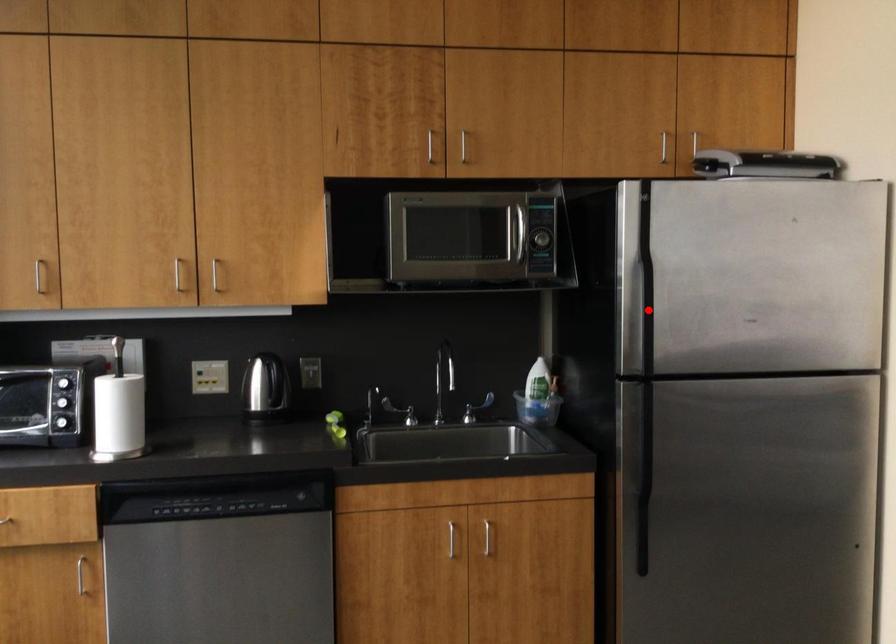
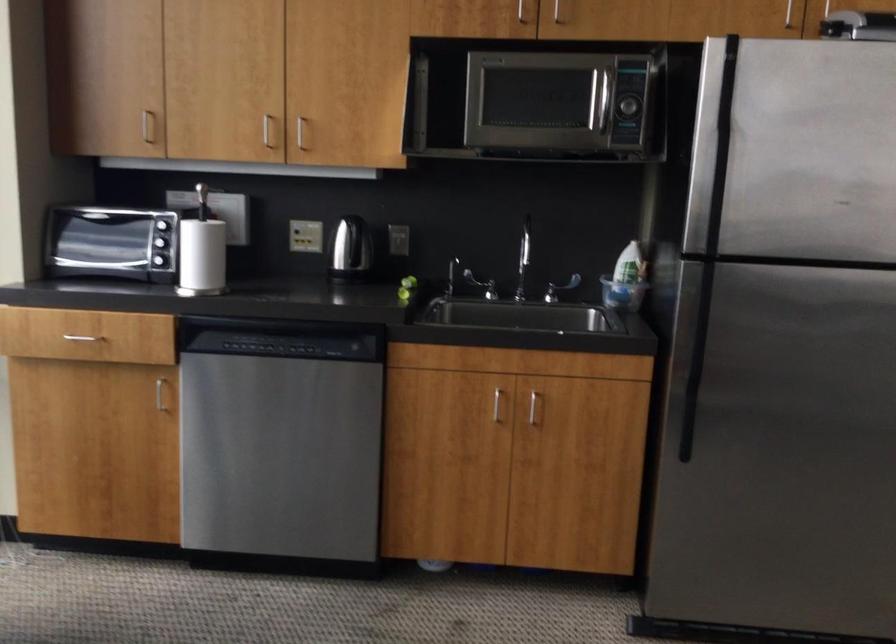
Where in the second image is the point corresponding to the highlighted location from the first image?

(718, 184)